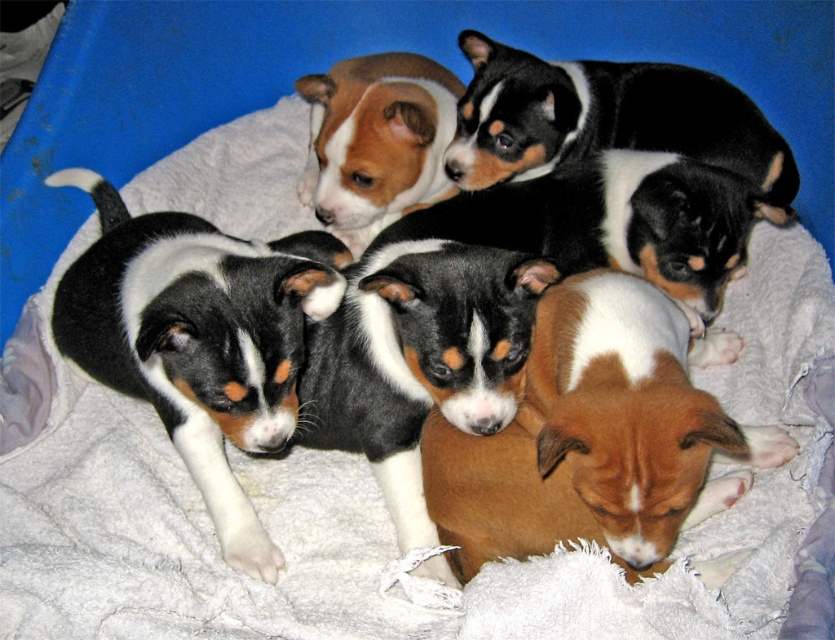
Question: Which of the following is the closest to the observer?

Choices:
 (A) brown fur at center
 (B) black and white fur at upper center
 (C) black and white fur puppy at center

Answer: (A)

Question: Does black and white fur puppy at center appear on the left side of black and white fur at upper center?

Choices:
 (A) no
 (B) yes

Answer: (B)

Question: Is black and white fur puppy at center thinner than black and white fur at upper center?

Choices:
 (A) no
 (B) yes

Answer: (B)

Question: Is brown fur at center positioned behind black and white fur at upper center?

Choices:
 (A) yes
 (B) no

Answer: (B)

Question: Which object appears farthest from the camera in this image?

Choices:
 (A) black and white fur at upper center
 (B) brown fur at center
 (C) black and white fur puppy at center

Answer: (A)

Question: Which object is farther from the camera taking this photo?

Choices:
 (A) black and white fur at upper center
 (B) brown fur at center
 (C) black and white fur puppy at center

Answer: (A)